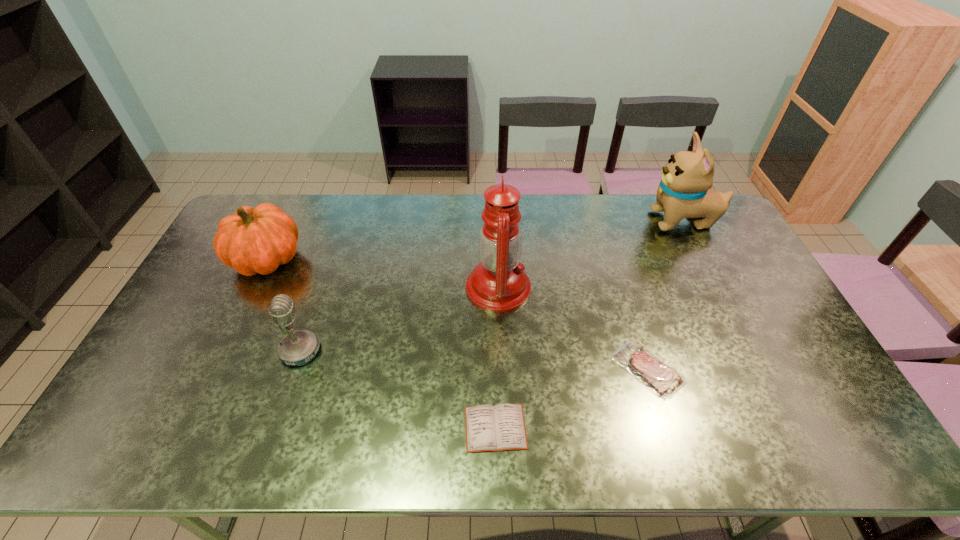
At what (x,y) coordinates should I click in order to perform the action: click on vacant space located on the face of the puppy. Please return your answer as a coordinate pair (x, y). This screenshot has height=540, width=960. Looking at the image, I should click on (538, 221).

Locate an element on the screen. Image resolution: width=960 pixels, height=540 pixels. free space located 0.050m on the face of the puppy is located at coordinates (633, 221).

At what (x,y) coordinates should I click in order to perform the action: click on vacant region located 0.060m on the face of the puppy. Please return your answer as a coordinate pair (x, y). The image size is (960, 540). Looking at the image, I should click on (631, 221).

This screenshot has height=540, width=960. I want to click on free space located 0.120m on the back of the leftmost object, so click(289, 213).

This screenshot has height=540, width=960. In order to click on vacant space located on the front-facing side of the second object from left to right in this screenshot , I will do `click(418, 350)`.

Identify the location of vacant space located 0.390m on the left of the fifth tallest object. The width and height of the screenshot is (960, 540). (466, 369).

The width and height of the screenshot is (960, 540). In order to click on vacant space located 0.130m on the left of the shortest object in this screenshot , I will do `click(411, 428)`.

I want to click on puppy at the far edge, so click(684, 191).

This screenshot has height=540, width=960. In order to click on pumpkin located in the far edge section of the desktop in this screenshot , I will do `click(255, 240)`.

This screenshot has height=540, width=960. I want to click on object that is positioned at the near edge, so click(x=500, y=427).